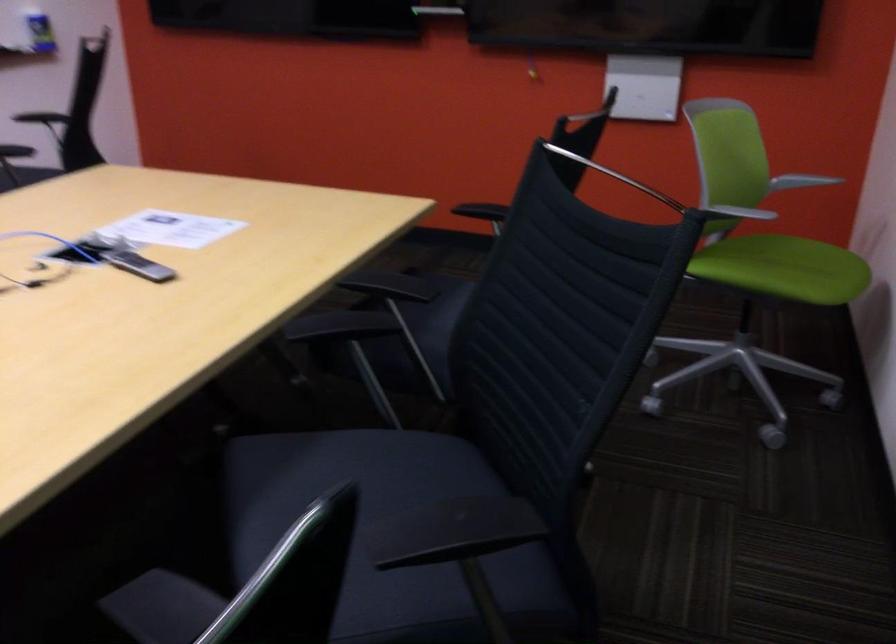
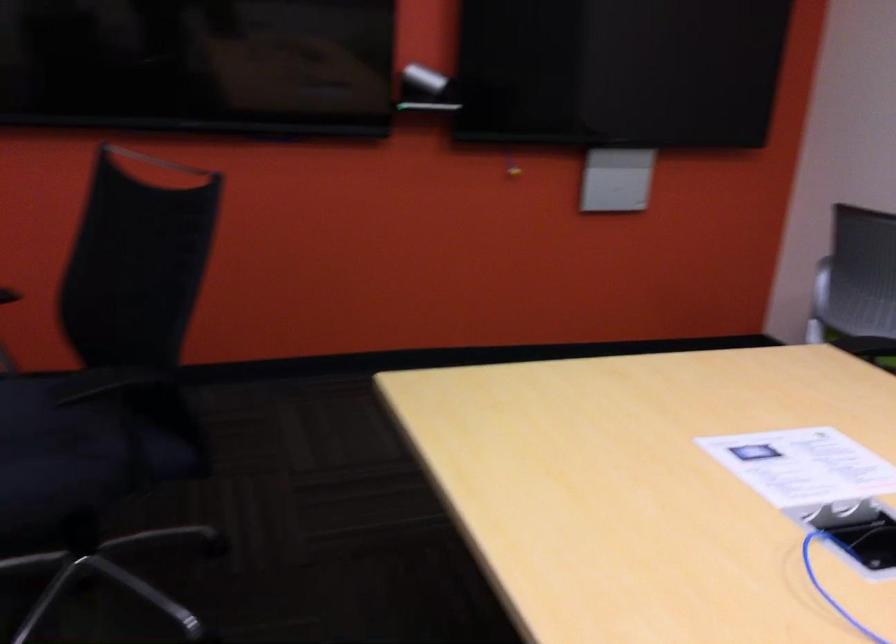
In the second image, find the point that corresponds to (x=154, y=261) in the first image.

(858, 532)